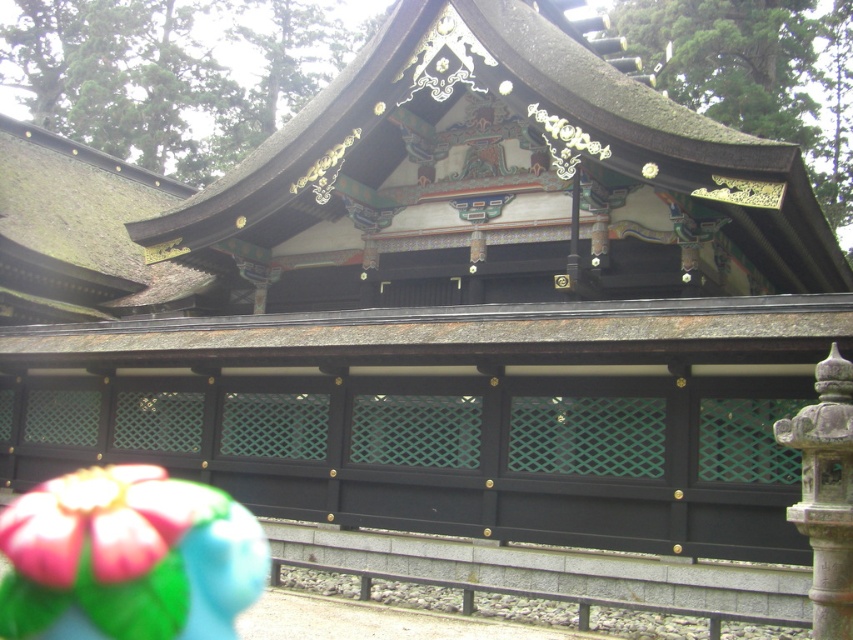
You are a visitor standing in front of the traditional Japanese structure. You notice the shiny dark brown roof at center and the green mossy thatch at upper left. Which object is closer to you?

The shiny dark brown roof at center is closer to you because it is in front of the green mossy thatch at upper left.

You are a visitor to this traditional Japanese structure and want to take a photo that captures both the shiny dark brown roof at center and the green mossy thatch at upper left. Given their sizes, which object should you frame first to ensure both fit in the shot?

The shiny dark brown roof at center is wider than the green mossy thatch at upper left, so you should frame the shiny dark brown roof at center first to ensure both fit in the shot.

You are a visitor at the temple and want to take a photo of the green mossy thatch at upper left. The temple has a strict rule that photography is only allowed within a 0.1 meter radius of the center point at coordinates 0.366, 0.095. Is your current position within the allowed area?

The green mossy thatch at upper left is located exactly at the center point (80, 234). Since the photography rule allows a 0.1 meter radius around this point, your position must be within 0.1 meters from this coordinate to comply. Without knowing your exact location, it cannot be determined if you are within the allowed area.